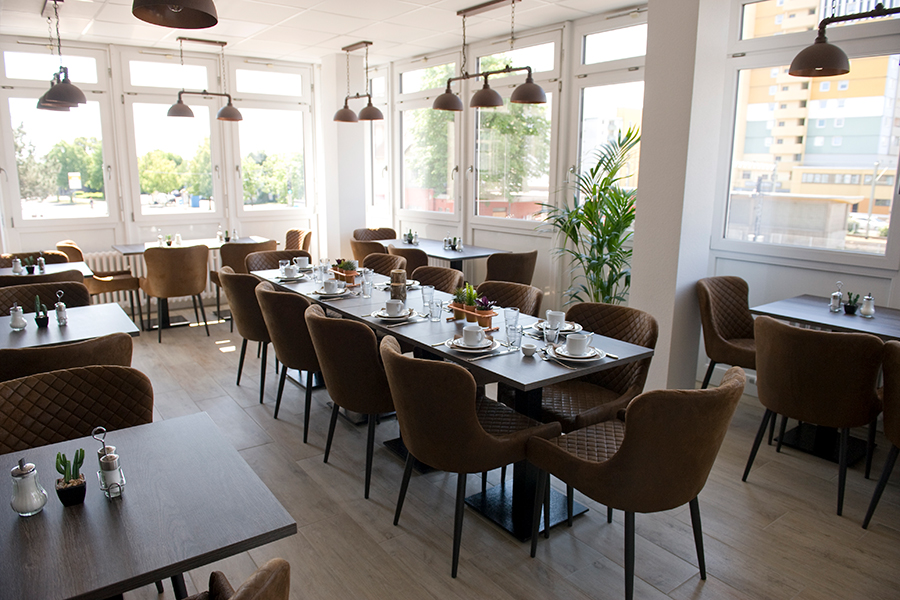
Where is `sugar containers`? Image resolution: width=900 pixels, height=600 pixels. sugar containers is located at coordinates (24, 491), (12, 318), (14, 264), (176, 239), (866, 308), (459, 245), (416, 240).